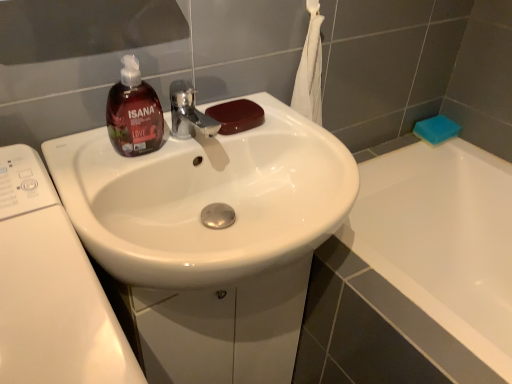
Identify the location of free point in front of brown matte liquid soap at upper left. (109, 182).